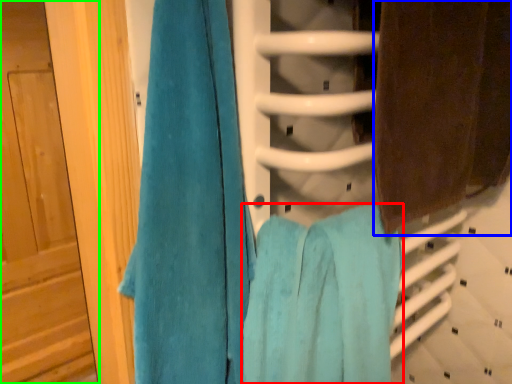
Question: Which object is the farthest from towel (highlighted by a red box)? Choose among these: towel (highlighted by a blue box) or door (highlighted by a green box).

Choices:
 (A) towel
 (B) door

Answer: (B)